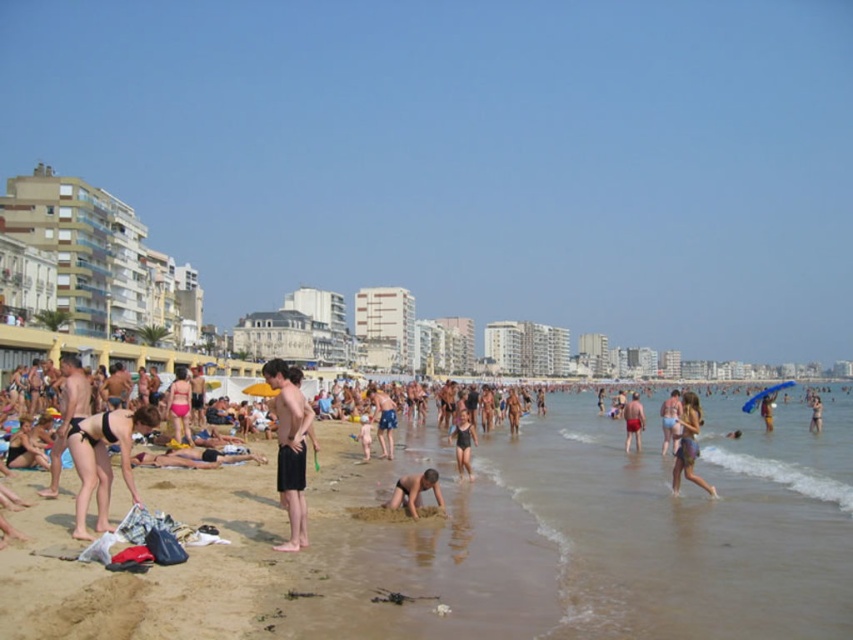
You are a photographer trying to capture a shot of the beige sand at center and the pink matte swimsuit at center from above. Which object will appear larger in the photo?

The pink matte swimsuit at center will appear larger in the photo because it is taller than the beige sand at center.

You are a photographer at the beach and want to capture a photo of the black matte shorts at center and the pink matte swimsuit at center. Which one is positioned lower in the image?

The black matte shorts at center is below the pink matte swimsuit at center, so it is positioned lower in the image.